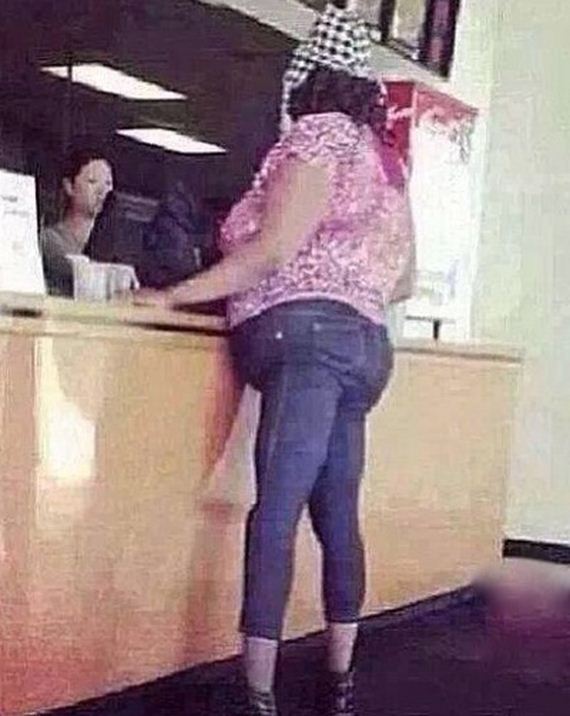
Find the location of a particular element. This screenshot has width=570, height=716. floor is located at coordinates (453, 672).